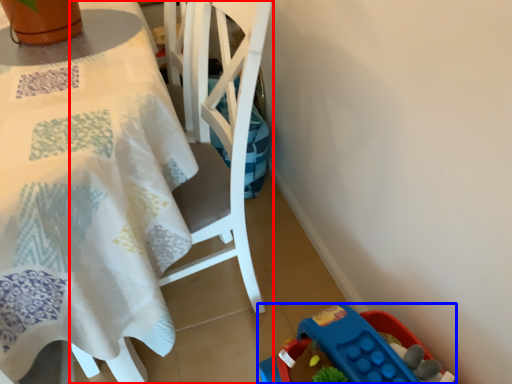
Question: Which object appears closest to the camera in this image, chair (highlighted by a red box) or toy (highlighted by a blue box)?

Choices:
 (A) chair
 (B) toy

Answer: (A)